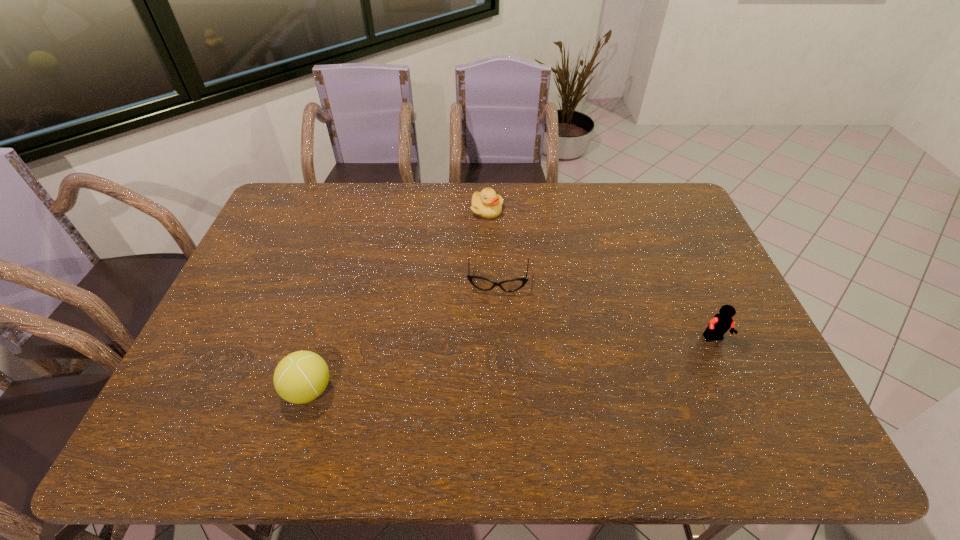
Locate an element on the screen. This screenshot has width=960, height=540. the leftmost object is located at coordinates (302, 376).

This screenshot has width=960, height=540. What are the coordinates of `the nearest object` in the screenshot? It's located at (302, 376).

This screenshot has width=960, height=540. Identify the location of the second nearest object. (720, 323).

At what (x,y) coordinates should I click in order to perform the action: click on Lego. Please return your answer as a coordinate pair (x, y). The height and width of the screenshot is (540, 960). Looking at the image, I should click on [720, 323].

What are the coordinates of `the shortest object` in the screenshot? It's located at (511, 285).

Identify the location of the third nearest object. The width and height of the screenshot is (960, 540). (511, 285).

At what (x,y) coordinates should I click in order to perform the action: click on the farthest object. Please return your answer as a coordinate pair (x, y). Image resolution: width=960 pixels, height=540 pixels. Looking at the image, I should click on (487, 204).

I want to click on the second shortest object, so click(487, 204).

I want to click on free space located 0.310m on the right of the tennis ball, so click(x=462, y=390).

The width and height of the screenshot is (960, 540). In order to click on free space located 0.160m on the front-facing side of the rightmost object in this screenshot , I will do `click(742, 402)`.